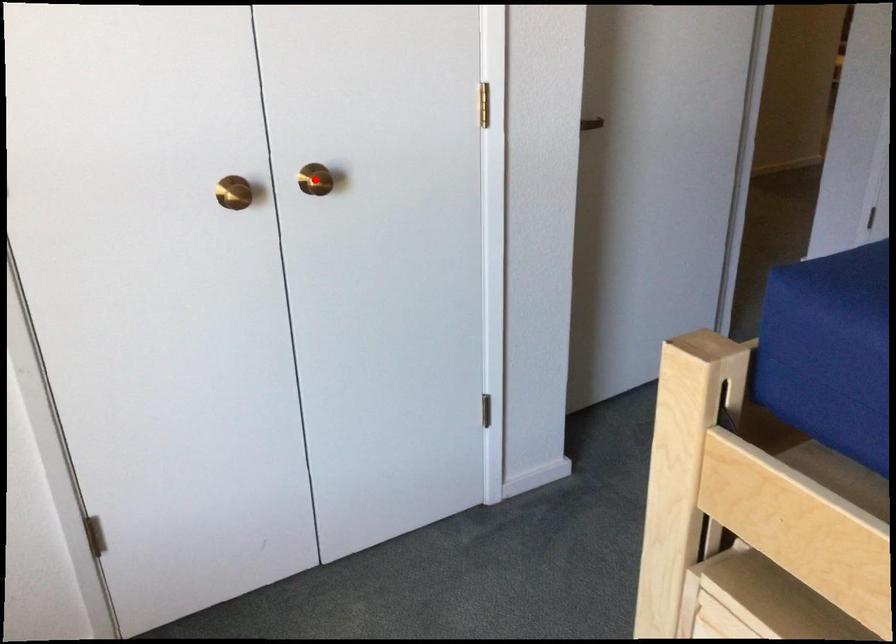
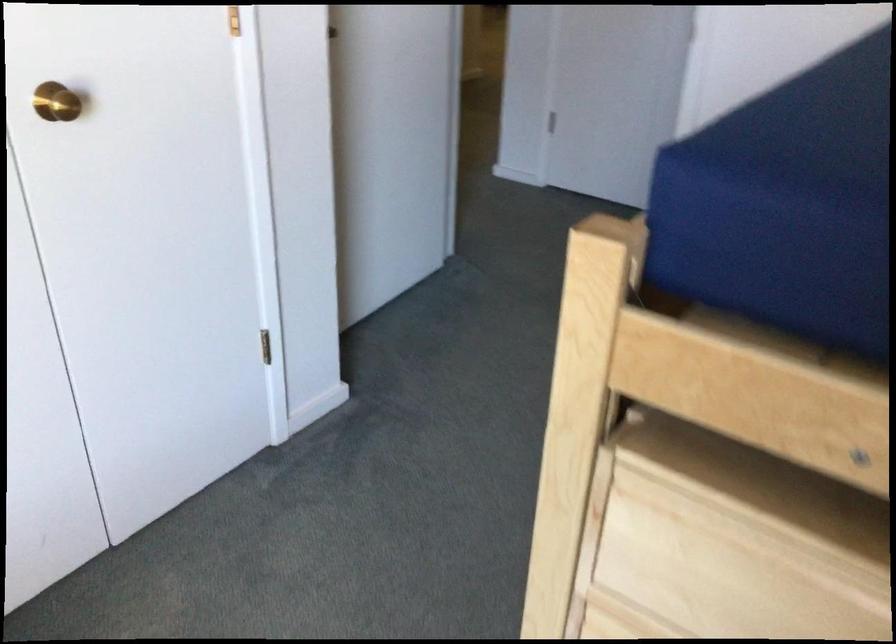
Locate, in the second image, the point that corresponds to the highlighted location in the first image.

(56, 102)